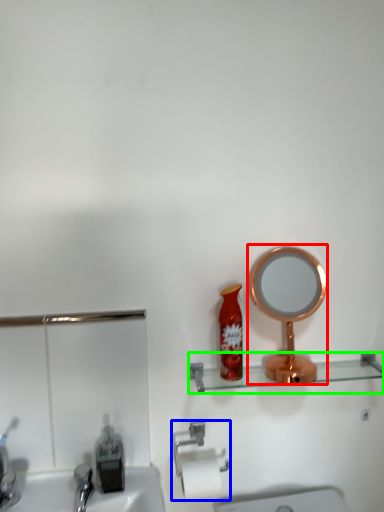
Question: Which object is positioned farthest from mirror (highlighted by a red box)? Select from towel bar (highlighted by a blue box) and shelve (highlighted by a green box).

Choices:
 (A) towel bar
 (B) shelve

Answer: (A)